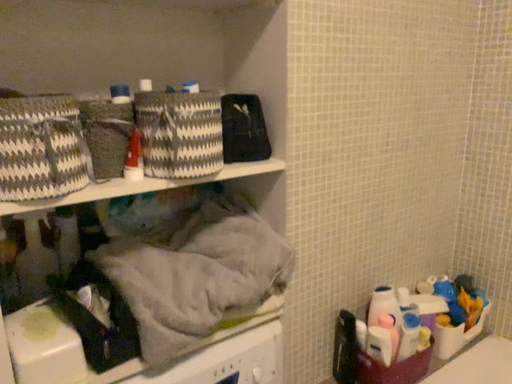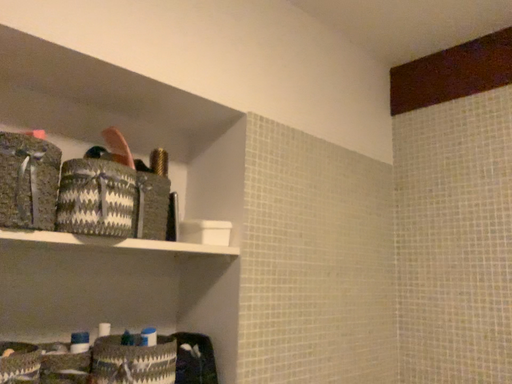
Question: Which way did the camera rotate in the video?

Choices:
 (A) rotated right
 (B) rotated left

Answer: (A)